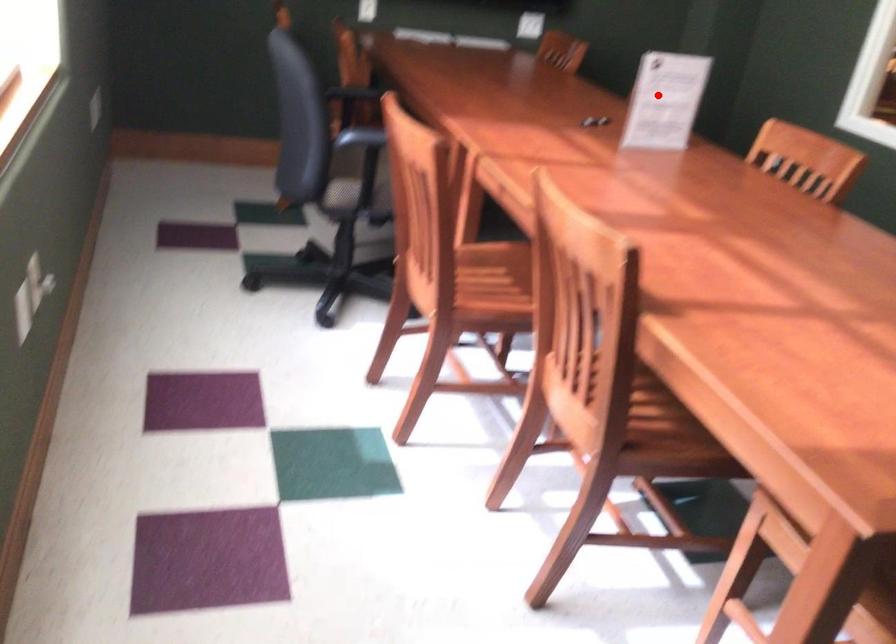
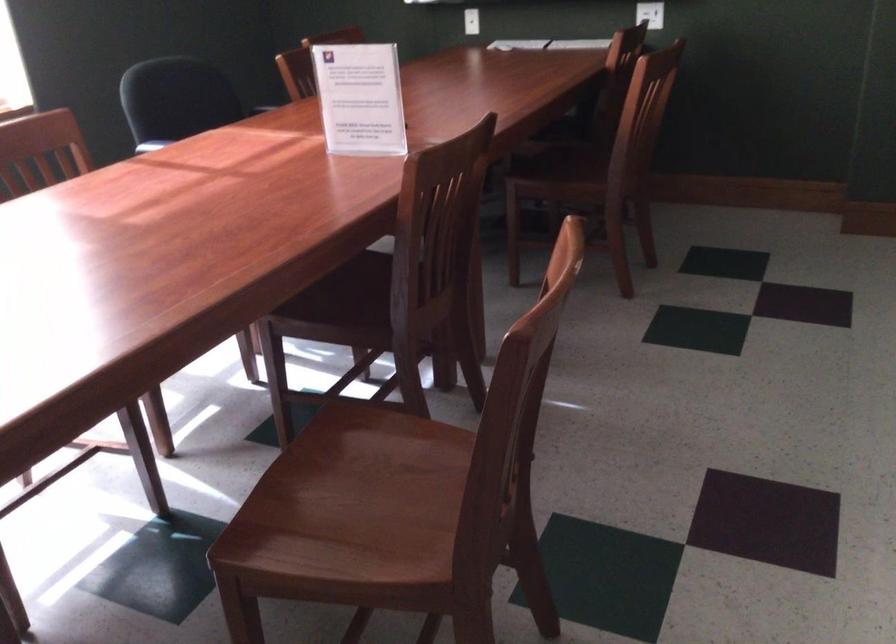
Where in the second image is the point corresponding to the highlighted location from the first image?

(359, 98)